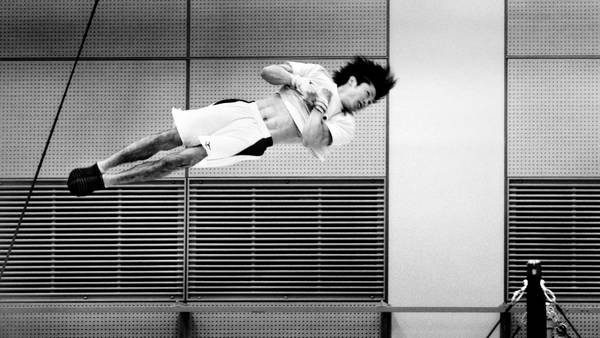
This screenshot has width=600, height=338. What are the coordinates of `grooved panel` in the screenshot? It's located at (289, 261).